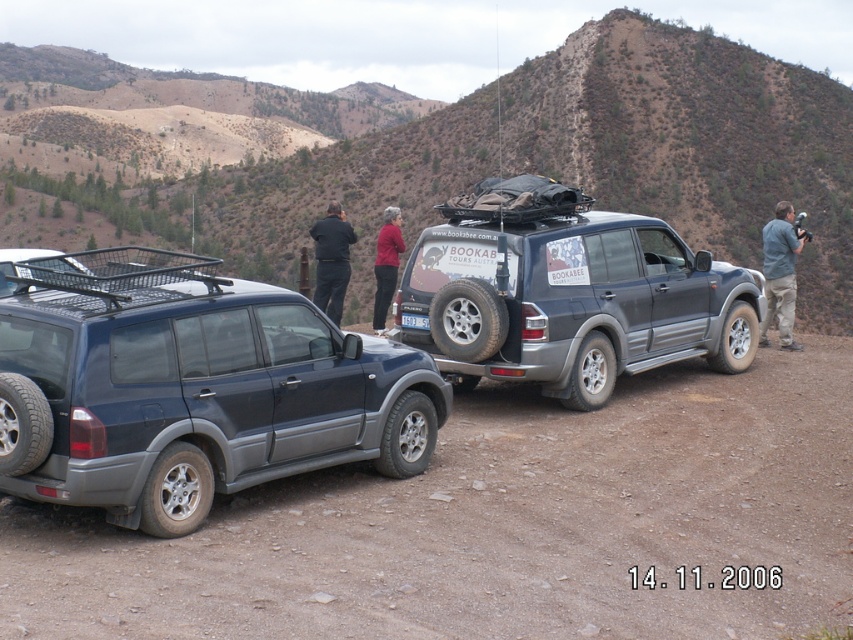
You are a hiker who needs to cross a narrow path between the two vehicles. The path is exactly 2 meters wide. Can you safely pass through without touching either the dark blue jeans at center or the dark red sweater at center?

The dark blue jeans at center and dark red sweater at center are 2.05 meters apart. Since the path is exactly 2 meters wide, you can safely pass through as the distance between them is slightly more than the required width.

You are a hiker who needs to retrieve your keys from the dark red sweater at center. You are currently holding the dark blue jeans at center. Can you reach the sweater without letting go of the jeans?

The dark blue jeans at center is located above the dark red sweater at center, so you can reach down to retrieve the keys from the sweater while holding the jeans.